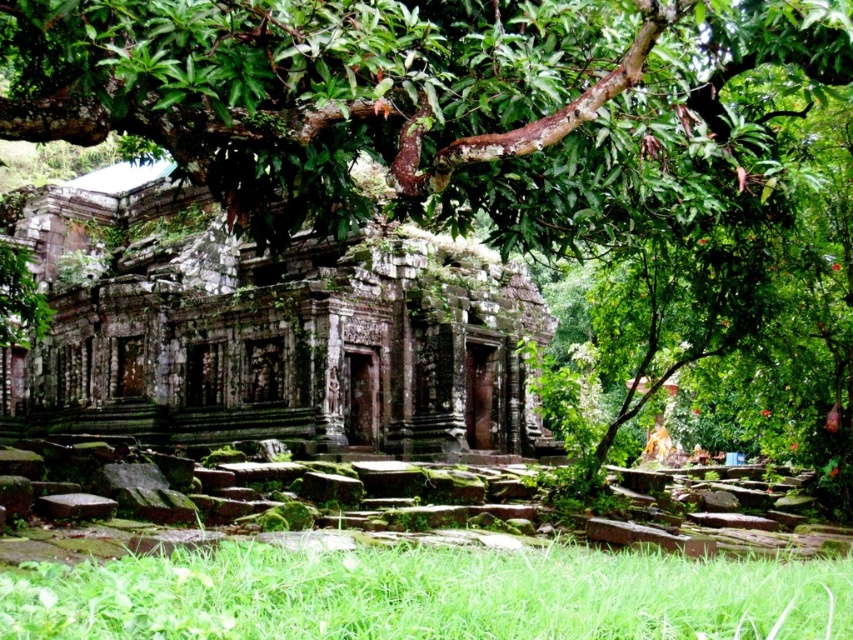
Is green leafy tree at upper center below green mossy stone temple at center?

No, green leafy tree at upper center is not below green mossy stone temple at center.

Measure the distance between green leafy tree at upper center and camera.

green leafy tree at upper center is 43.13 meters from camera.

In order to click on green leafy tree at upper center in this screenshot , I will do `click(421, 100)`.

What do you see at coordinates (267, 332) in the screenshot?
I see `green mossy stone temple at center` at bounding box center [267, 332].

Is point (165, 212) behind point (524, 595)?

Yes, point (165, 212) is behind point (524, 595).

Is point (140, 218) positioned behind point (502, 627)?

Yes, point (140, 218) is behind point (502, 627).

The height and width of the screenshot is (640, 853). In order to click on green mossy stone temple at center in this screenshot , I will do `click(267, 332)`.

From the picture: Between green leafy tree at upper center and green grass at lower center, which one is positioned lower?

green grass at lower center

Is point (351, 8) positioned before point (0, 579)?

No, (351, 8) is further to viewer.

Locate an element on the screen. green leafy tree at upper center is located at coordinates (421, 100).

Where is `green leafy tree at upper center`? green leafy tree at upper center is located at coordinates [421, 100].